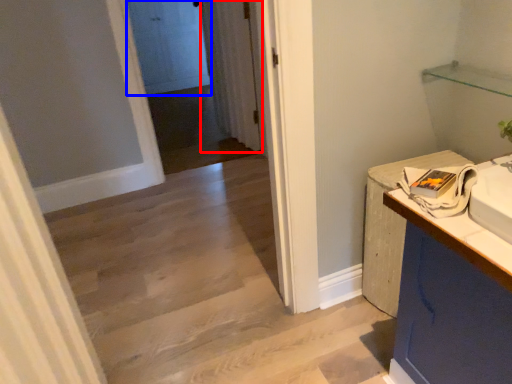
Question: Among these objects, which one is nearest to the camera, curtain (highlighted by a red box) or door (highlighted by a blue box)?

Choices:
 (A) curtain
 (B) door

Answer: (A)